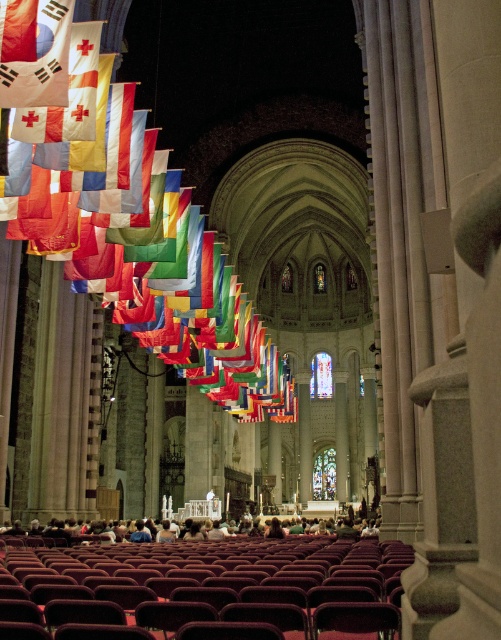
Question: Is matte white flag at upper left smaller than matte red flag at upper left?

Choices:
 (A) no
 (B) yes

Answer: (A)

Question: Estimate the real-world distances between objects in this image. Which object is closer to the matte white flag at upper left?

Choices:
 (A) velvet maroon chairs at lower center
 (B) matte red flag at upper left

Answer: (A)

Question: Does matte white flag at upper left appear on the left side of matte red flag at upper left?

Choices:
 (A) yes
 (B) no

Answer: (B)

Question: Which object is closer to the camera taking this photo?

Choices:
 (A) matte red flag at upper left
 (B) matte white flag at upper left

Answer: (B)

Question: Which object appears closest to the camera in this image?

Choices:
 (A) matte red flag at upper left
 (B) matte white flag at upper left

Answer: (B)

Question: Is the position of velvet maroon chairs at lower center more distant than that of matte white flag at upper left?

Choices:
 (A) yes
 (B) no

Answer: (B)